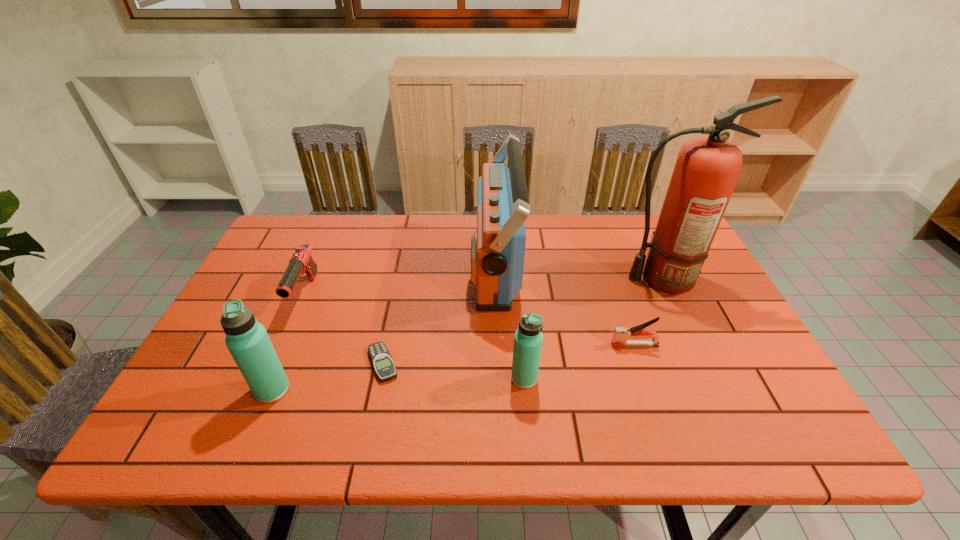
The width and height of the screenshot is (960, 540). I want to click on free spot located on the back of the taller thermos bottle, so click(x=312, y=295).

Where is `free space located on the left of the fourth tallest object`? This screenshot has width=960, height=540. free space located on the left of the fourth tallest object is located at coordinates (352, 378).

Where is `free space located on the handle side of the stapler`? free space located on the handle side of the stapler is located at coordinates (460, 345).

Where is `vacant space located on the handle side of the stapler`? Image resolution: width=960 pixels, height=540 pixels. vacant space located on the handle side of the stapler is located at coordinates (505, 345).

The image size is (960, 540). I want to click on free point located 0.110m on the handle side of the stapler, so click(566, 345).

Identify the location of vacant area situated on the front-facing side of the second tallest object. This screenshot has width=960, height=540. (408, 268).

Locate an element on the screen. The image size is (960, 540). free space located 0.240m on the front-facing side of the second tallest object is located at coordinates (391, 268).

Where is `vacant space situated on the front-facing side of the second tallest object`? vacant space situated on the front-facing side of the second tallest object is located at coordinates (336, 268).

Locate an element on the screen. This screenshot has height=540, width=960. free location located 0.100m on the nozzle of the tallest object is located at coordinates tap(584, 279).

Where is `free region located 0.210m on the nozzle of the tallest object`? free region located 0.210m on the nozzle of the tallest object is located at coordinates (544, 279).